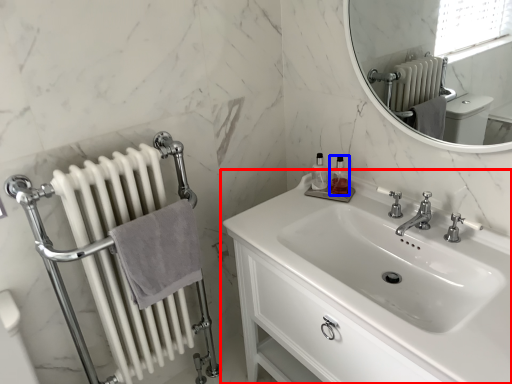
Question: Which of the following is the closest to the observer, sink (highlighted by a red box) or toiletry (highlighted by a blue box)?

Choices:
 (A) sink
 (B) toiletry

Answer: (A)